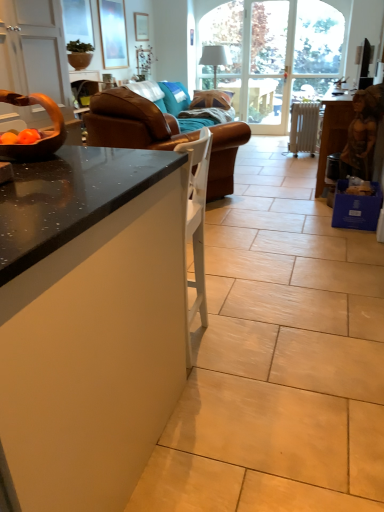
Measure the distance between point (296, 114) and camera.

Point (296, 114) and camera are 5.23 meters apart.

Locate an element on the screen. This screenshot has width=384, height=512. brown leather bowl at left is located at coordinates (45, 131).

In order to click on black glossy television at upper right in this screenshot , I will do 363,64.

Find the location of a particular element. Image resolution: width=384 pixels, height=512 pixels. black glossy desk at lower left is located at coordinates (88, 322).

Looking at this image, is the depth of matte glass picture frame at upper left, marked as the 2th picture frame in a back-to-front arrangement, greater than that of brown leather bowl at left?

Yes, the depth of matte glass picture frame at upper left, marked as the 2th picture frame in a back-to-front arrangement, is greater than that of brown leather bowl at left.

Could you tell me if matte glass picture frame at upper left, marked as the 2th picture frame in a back-to-front arrangement, is turned towards brown leather bowl at left?

No, matte glass picture frame at upper left, marked as the 2th picture frame in a back-to-front arrangement, does not turn towards brown leather bowl at left.

Which object is thinner, matte glass picture frame at upper left, the 1th picture frame in the front-to-back sequence, or brown leather bowl at left?

With smaller width is matte glass picture frame at upper left, the 1th picture frame in the front-to-back sequence.

From the image's perspective, is matte glass picture frame at upper left, the first picture frame positioned from the left, above brown leather bowl at left?

Indeed, from the image's perspective, matte glass picture frame at upper left, the first picture frame positioned from the left, is shown above brown leather bowl at left.

Does black glossy desk at lower left turn towards white glass screen door at center?

Yes, black glossy desk at lower left is facing white glass screen door at center.

Considering the sizes of objects black glossy desk at lower left and white glass screen door at center in the image provided, who is thinner, black glossy desk at lower left or white glass screen door at center?

white glass screen door at center.

Which of these two, black glossy desk at lower left or white glass screen door at center, is smaller?

white glass screen door at center is smaller.

Which is in front, point (131, 454) or point (283, 81)?

The point (131, 454) is closer to the camera.

Considering the positions of objects brown leather bowl at left and brown leather couch at center in the image provided, who is behind, brown leather bowl at left or brown leather couch at center?

brown leather couch at center is further away from the camera.

Does point (53, 104) come farther from viewer compared to point (221, 163)?

No, it is not.

Is brown leather bowl at left inside the boundaries of brown leather couch at center, or outside?

The correct answer is: outside.

Is brown leather bowl at left oriented towards brown leather couch at center?

Yes, brown leather bowl at left is turned towards brown leather couch at center.

Which is in front, point (182, 109) or point (138, 18)?

The point (182, 109) is closer.

In terms of width, does blue fabric pillow at center look wider or thinner when compared to wooden picture frame at upper center, acting as the first picture frame starting from the back?

In the image, blue fabric pillow at center appears to be wider than wooden picture frame at upper center, acting as the first picture frame starting from the back.

From the image's perspective, is blue fabric pillow at center beneath wooden picture frame at upper center, acting as the first picture frame starting from the back?

Yes, from the image's perspective, blue fabric pillow at center is beneath wooden picture frame at upper center, acting as the first picture frame starting from the back.

Is blue fabric pillow at center completely or partially outside of wooden picture frame at upper center, which is counted as the second picture frame, starting from the front?

Yes.

The height and width of the screenshot is (512, 384). I want to click on desk below the brown leather bowl at left (from a real-world perspective), so click(x=88, y=322).

Is brown leather bowl at left not inside black glossy desk at lower left?

brown leather bowl at left is positioned outside black glossy desk at lower left.

Does point (47, 105) come behind point (95, 474)?

That is True.

Considering the points (131, 129) and (376, 205), which point is in front, point (131, 129) or point (376, 205)?

Positioned in front is point (376, 205).

Is brown leather couch at center positioned far away from blue cardboard box at lower right?

Yes, brown leather couch at center is far from blue cardboard box at lower right.

How many degrees apart are the facing directions of brown leather couch at center and blue cardboard box at lower right?

There is a 120-degree angle between the facing directions of brown leather couch at center and blue cardboard box at lower right.

Between brown leather couch at center and blue cardboard box at lower right, which one is positioned in front?

brown leather couch at center is in front.

Is matte glass picture frame at upper left, the first picture frame positioned from the left, positioned before wooden picture frame at upper center, the 2th picture frame positioned from the left?

Yes, it is.

From the image's perspective, is matte glass picture frame at upper left, the first picture frame positioned from the left, under wooden picture frame at upper center, which is counted as the second picture frame, starting from the front?

Indeed, from the image's perspective, matte glass picture frame at upper left, the first picture frame positioned from the left, is shown beneath wooden picture frame at upper center, which is counted as the second picture frame, starting from the front.

Is wooden picture frame at upper center, which is counted as the second picture frame, starting from the front, a part of matte glass picture frame at upper left, which is the second picture frame from right to left?

No, wooden picture frame at upper center, which is counted as the second picture frame, starting from the front, is not surrounded by matte glass picture frame at upper left, which is the second picture frame from right to left.

Which of these two, matte glass picture frame at upper left, which is the second picture frame from right to left, or wooden picture frame at upper center, which is the 1th picture frame from right to left, is wider?

matte glass picture frame at upper left, which is the second picture frame from right to left.

Locate an element on the screen. This screenshot has width=384, height=512. picture frame that is the 1st one when counting backward from the brown leather bowl at left is located at coordinates (113, 33).

Where is `desk in front of the white glass screen door at center`? Image resolution: width=384 pixels, height=512 pixels. desk in front of the white glass screen door at center is located at coordinates click(x=88, y=322).

Based on their spatial positions, is blue fabric pillow at center or black glossy television at upper right further from white metallic radiator at right?

Among the two, blue fabric pillow at center is located further to white metallic radiator at right.

Which object lies nearer to the anchor point white metallic radiator at right, matte glass picture frame at upper left, the 1th picture frame in the front-to-back sequence, or brown leather bowl at left?

matte glass picture frame at upper left, the 1th picture frame in the front-to-back sequence, lies closer to white metallic radiator at right than the other object.

Which object lies nearer to the anchor point blue fabric pillow at center, brown leather couch at center or wooden statue at right?

brown leather couch at center is positioned closer to the anchor blue fabric pillow at center.

When comparing their distances from black glossy desk at lower left, does blue fabric pillow at center or brown leather couch at center seem closer?

brown leather couch at center lies closer to black glossy desk at lower left than the other object.

From the image, which object appears to be farther from matte glass picture frame at upper left, the 1th picture frame in the front-to-back sequence, blue cardboard box at lower right or black glossy television at upper right?

Based on the image, blue cardboard box at lower right appears to be further to matte glass picture frame at upper left, the 1th picture frame in the front-to-back sequence.

From the image, which object appears to be nearer to blue fabric pillow at center, white glass screen door at center or white metallic radiator at right?

white metallic radiator at right lies closer to blue fabric pillow at center than the other object.

When comparing their distances from wooden picture frame at upper center, which is counted as the second picture frame, starting from the front, does black glossy desk at lower left or white metallic radiator at right seem further?

black glossy desk at lower left.

Which object lies further to the anchor point black glossy desk at lower left, blue fabric pillow at center or white glass screen door at center?

white glass screen door at center is positioned further to the anchor black glossy desk at lower left.

Identify the location of screen door between matte glass picture frame at upper left, the first picture frame positioned from the left, and black glossy television at upper right from left to right. The width and height of the screenshot is (384, 512). (264, 64).

Find the location of `pillow located between black glossy desk at lower left and wooden picture frame at upper center, which is counted as the second picture frame, starting from the front, in the depth direction`. pillow located between black glossy desk at lower left and wooden picture frame at upper center, which is counted as the second picture frame, starting from the front, in the depth direction is located at coordinates (175, 97).

Where is `bowl between black glossy desk at lower left and blue fabric pillow at center along the z-axis`? Image resolution: width=384 pixels, height=512 pixels. bowl between black glossy desk at lower left and blue fabric pillow at center along the z-axis is located at coordinates (45, 131).

The height and width of the screenshot is (512, 384). In order to click on picture frame between matte glass picture frame at upper left, the 1th picture frame in the front-to-back sequence, and white metallic radiator at right, in the horizontal direction in this screenshot , I will do `click(141, 26)`.